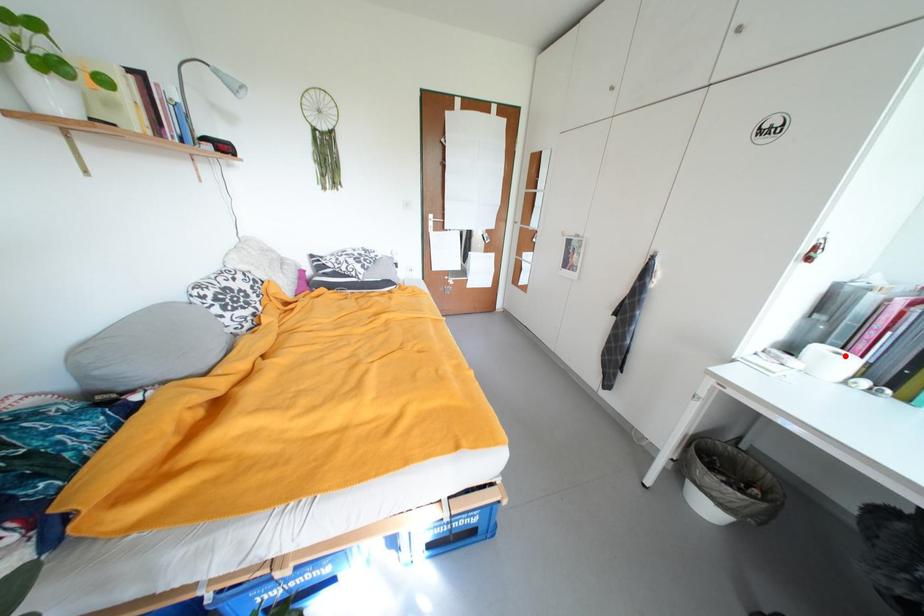
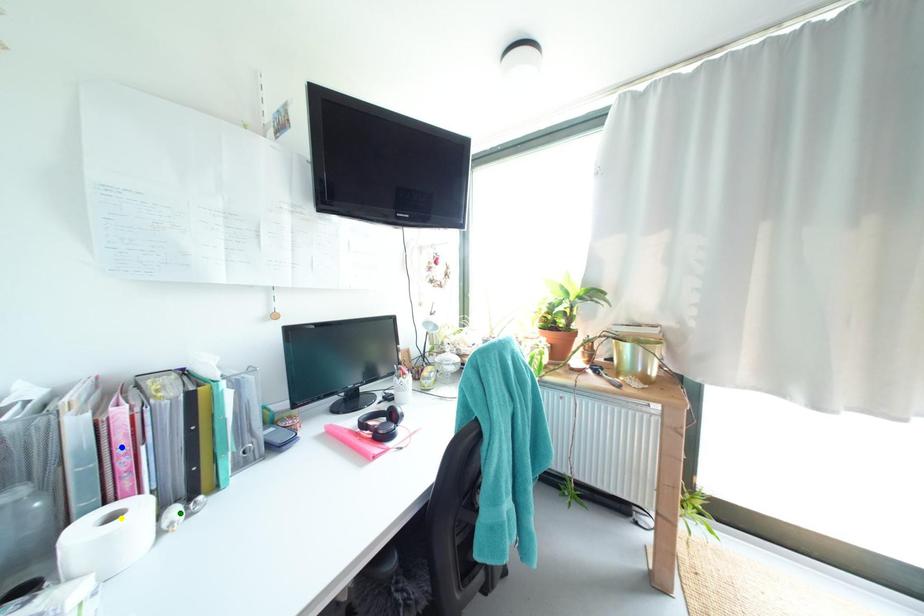
Question: I am providing you with two images of the same scene from different viewpoints. A red point is marked on the first image. You are given multiple points on the second image. Can you choose the point in image 2 that corresponds to the point in image 1?

Choices:
 (A) blue point
 (B) green point
 (C) yellow point

Answer: (C)